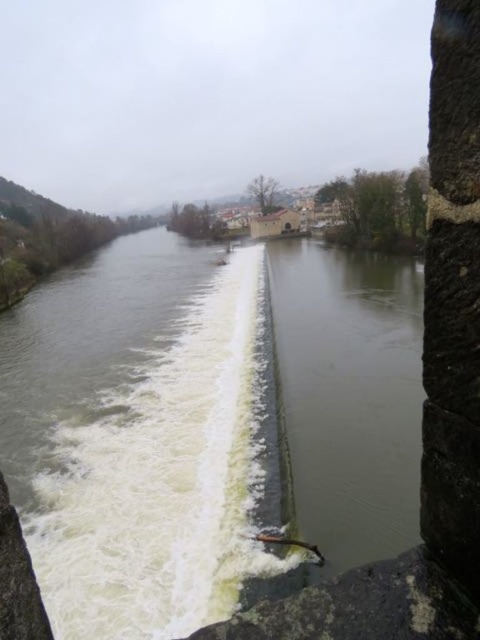
Question: Can you confirm if greenish concrete river at center is thinner than greenish concrete dam at center?

Choices:
 (A) no
 (B) yes

Answer: (A)

Question: Can you confirm if greenish concrete river at center is positioned to the left of greenish concrete dam at center?

Choices:
 (A) no
 (B) yes

Answer: (B)

Question: Which point is farther from the camera taking this photo?

Choices:
 (A) (402, 358)
 (B) (86, 358)

Answer: (B)

Question: Which of the following is the farthest from the observer?

Choices:
 (A) greenish concrete dam at center
 (B) greenish concrete river at center

Answer: (A)

Question: Is greenish concrete river at center to the right of greenish concrete dam at center from the viewer's perspective?

Choices:
 (A) no
 (B) yes

Answer: (A)